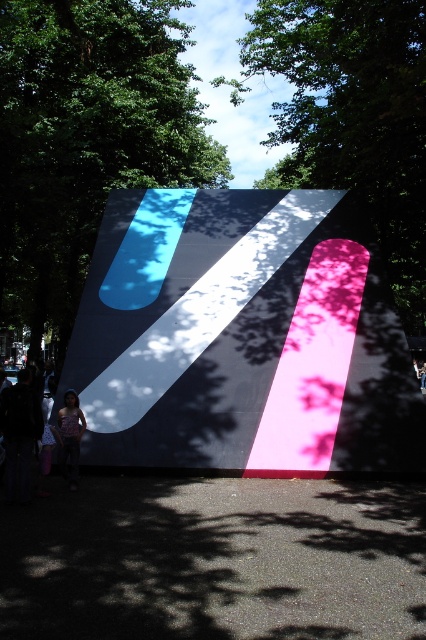
Question: Does matte pink dress at lower left appear under denim shorts at lower left?

Choices:
 (A) no
 (B) yes

Answer: (B)

Question: Estimate the real-world distances between objects in this image. Which object is closer to the denim shorts at lower left?

Choices:
 (A) green leafy tree at center
 (B) green leafy tree at upper center
 (C) matte pink dress at lower left

Answer: (C)

Question: Which of these objects is positioned closest to the green leafy tree at center?

Choices:
 (A) matte pink dress at lower left
 (B) denim shorts at lower left

Answer: (B)

Question: Which point is closer to the camera?

Choices:
 (A) (83, 413)
 (B) (40, 45)
 (C) (14, 413)

Answer: (C)

Question: Is green leafy tree at upper center positioned behind matte pink dress at lower left?

Choices:
 (A) yes
 (B) no

Answer: (A)

Question: Does green leafy tree at center have a lesser width compared to matte pink dress at lower left?

Choices:
 (A) yes
 (B) no

Answer: (B)